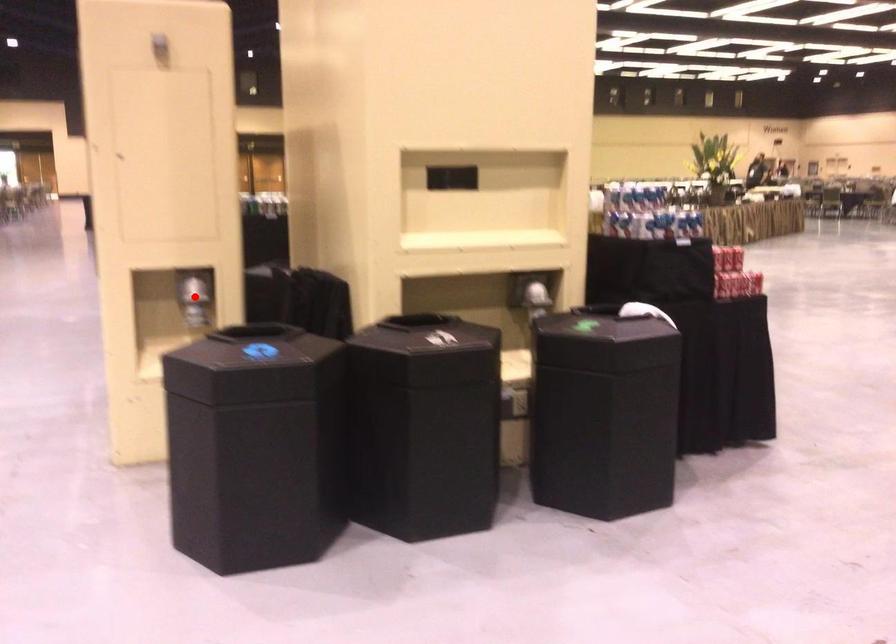
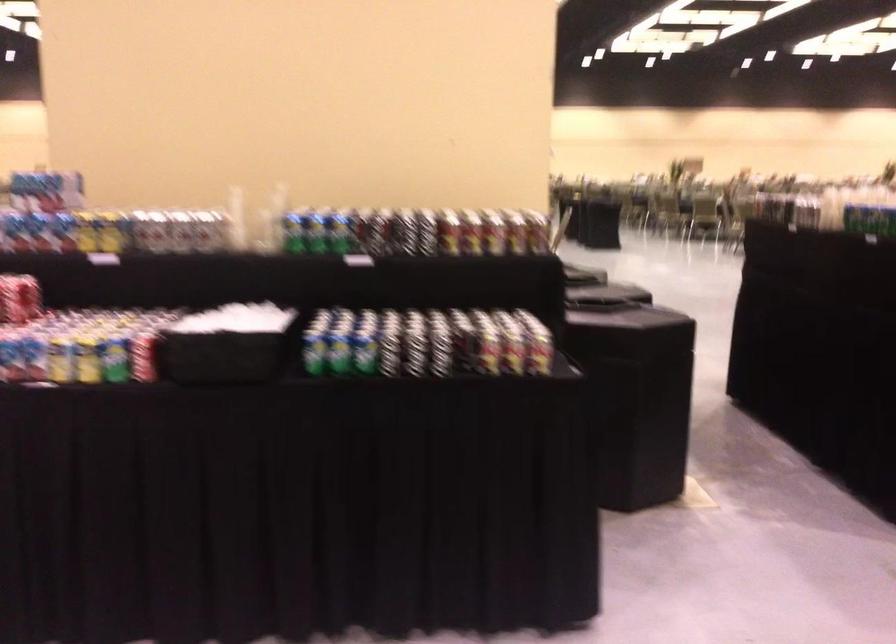
Question: I am providing you with two images of the same scene from different viewpoints. A red point is marked on the first image. At the location where the point appears in image 1, is it still visible in image 2?

Choices:
 (A) Yes
 (B) No

Answer: (B)